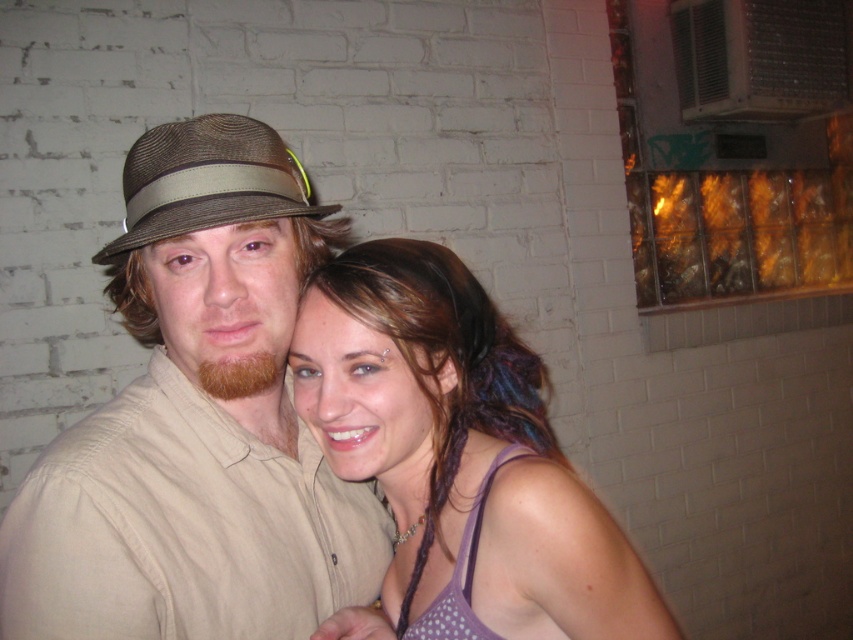
Question: Is purple dotted tank top at center further to the viewer compared to brown woven hat at left?

Choices:
 (A) yes
 (B) no

Answer: (A)

Question: Can you confirm if matte brown hat at center is positioned below brown woven hat at left?

Choices:
 (A) yes
 (B) no

Answer: (A)

Question: Is matte brown hat at center above brown woven hat at left?

Choices:
 (A) no
 (B) yes

Answer: (A)

Question: Which point is closer to the camera taking this photo?

Choices:
 (A) (566, 509)
 (B) (164, 218)
 (C) (251, 189)

Answer: (B)

Question: Which point is farther from the camera taking this photo?

Choices:
 (A) (122, 236)
 (B) (643, 568)
 (C) (187, 582)

Answer: (B)

Question: Based on their relative distances, which object is nearer to the purple dotted tank top at center?

Choices:
 (A) matte brown hat at center
 (B) brown woven hat at left

Answer: (A)